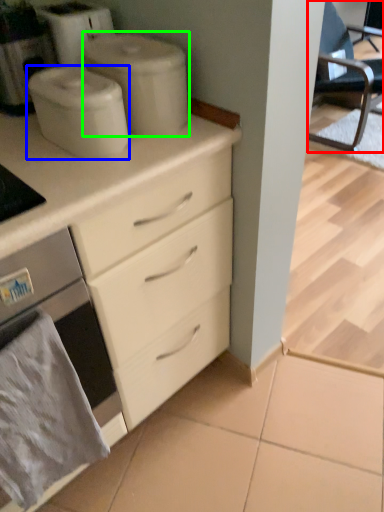
Question: Which object is the closest to the chair (highlighted by a red box)? Choose among these: appliance (highlighted by a blue box) or appliance (highlighted by a green box).

Choices:
 (A) appliance
 (B) appliance

Answer: (B)